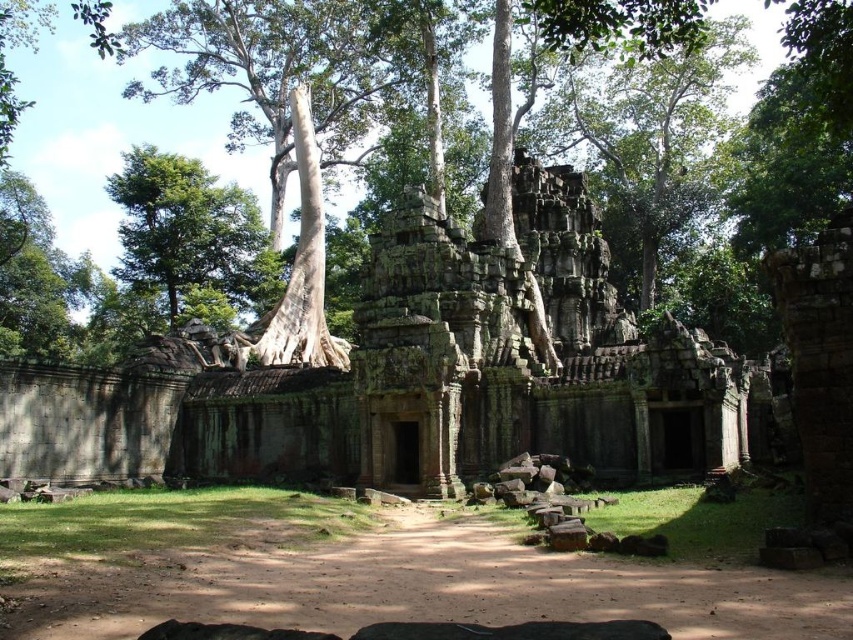
You are a botanist studying the trees in the ancient stone structure. You notice two trees, the green textured tree at center and the green leafy tree at upper left. Which tree would cast a larger shadow given their sizes?

The green textured tree at center has a larger size compared to the green leafy tree at upper left, so it would cast a larger shadow.